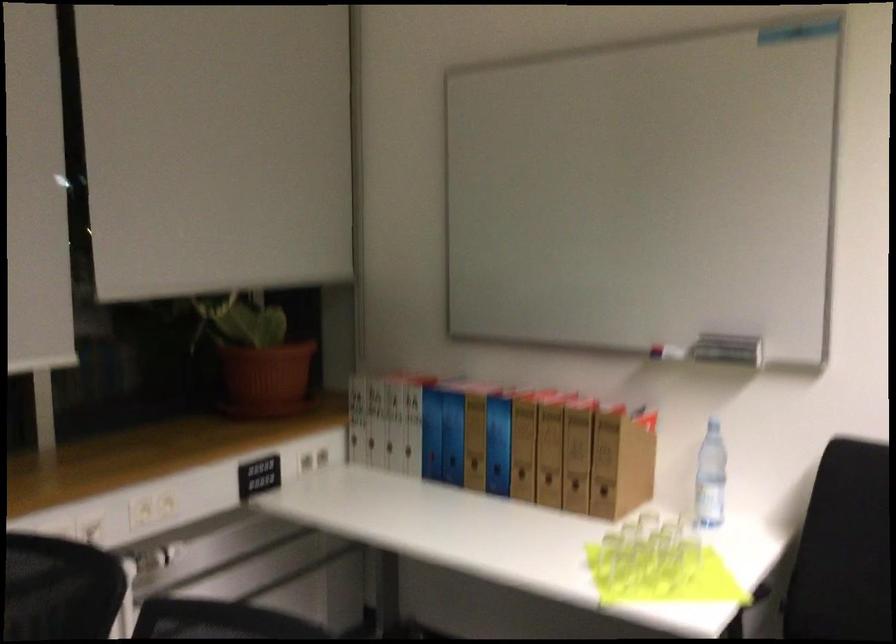
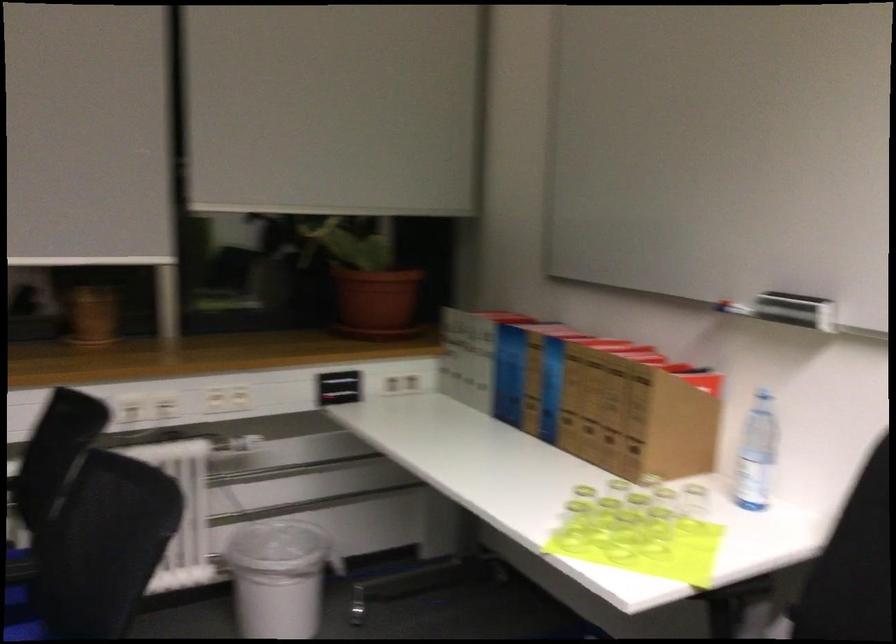
Where in the second image is the point corresponding to pixel 729 351 from the first image?

(795, 310)